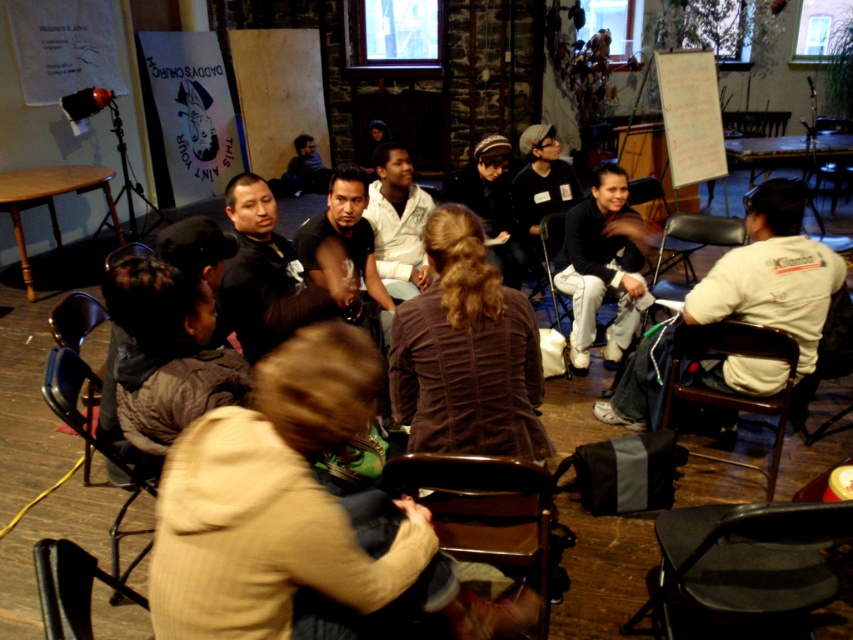
Question: Does black fabric chair at lower right have a larger size compared to dark brown leather jacket at center?

Choices:
 (A) no
 (B) yes

Answer: (A)

Question: Which of the following is the closest to the observer?

Choices:
 (A) (529, 138)
 (B) (512, 541)
 (C) (50, 616)

Answer: (C)

Question: Is white cotton shirt at right positioned before dark gray knit hat at center?

Choices:
 (A) yes
 (B) no

Answer: (A)

Question: Where is brown fabric chair at lower center located in relation to dark gray knit hat at center in the image?

Choices:
 (A) above
 (B) below

Answer: (B)

Question: Which object is the farthest from the white cotton shirt at right?

Choices:
 (A) dark brown leather jacket at center
 (B) dark brown leather chair at lower left

Answer: (B)

Question: Which point is closer to the camera taking this photo?

Choices:
 (A) (563, 170)
 (B) (589, 237)
 (C) (467, 195)

Answer: (B)